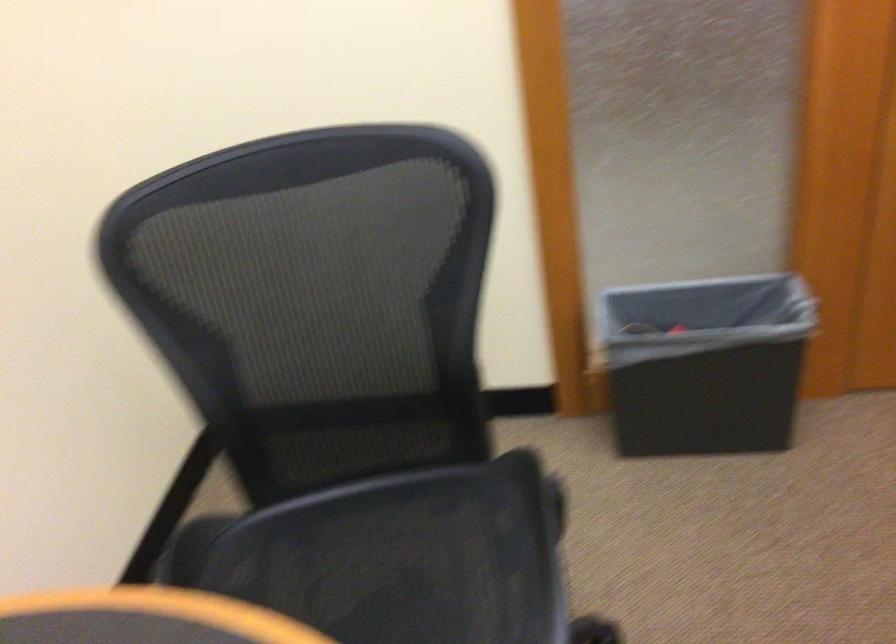
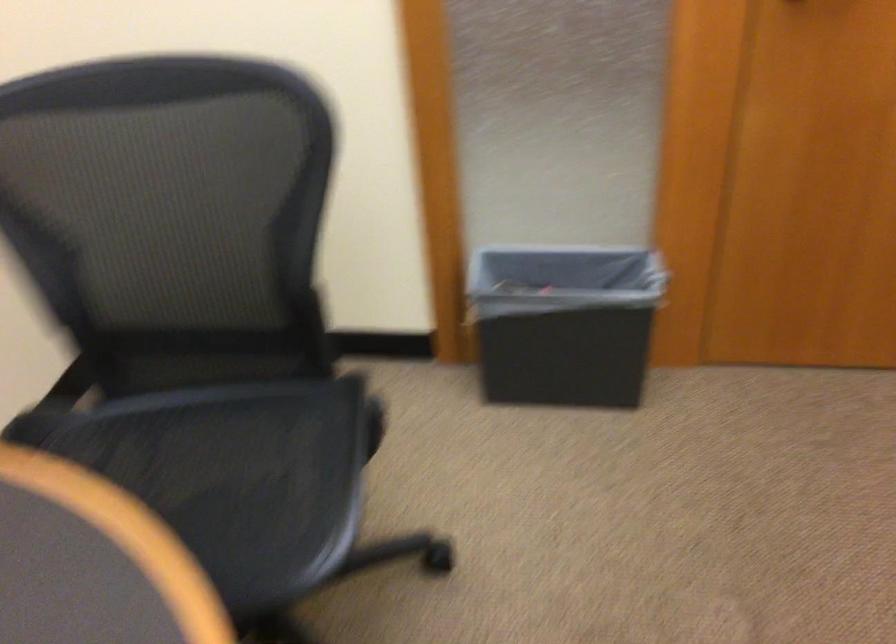
Find the pixel in the second image that matches (x=704, y=363) in the first image.

(564, 323)